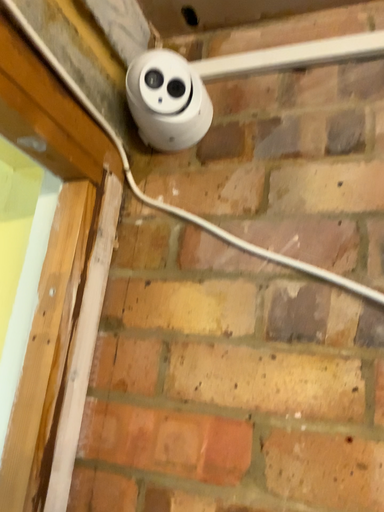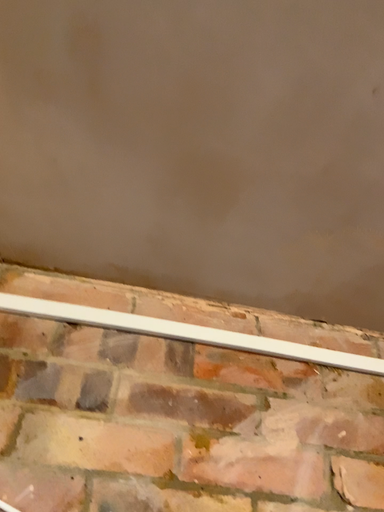
Question: Which way did the camera rotate in the video?

Choices:
 (A) rotated left
 (B) rotated right

Answer: (B)